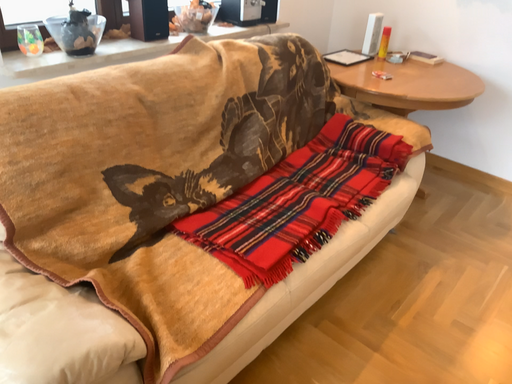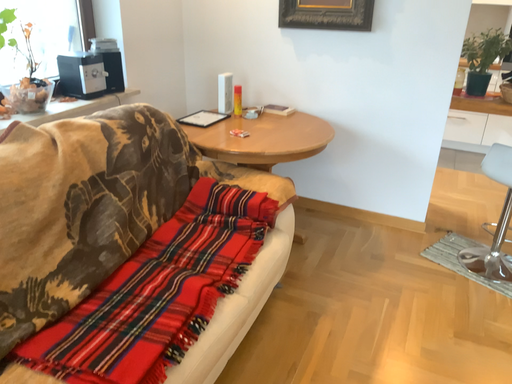
Question: How did the camera likely rotate when shooting the video?

Choices:
 (A) rotated downward
 (B) rotated upward

Answer: (B)